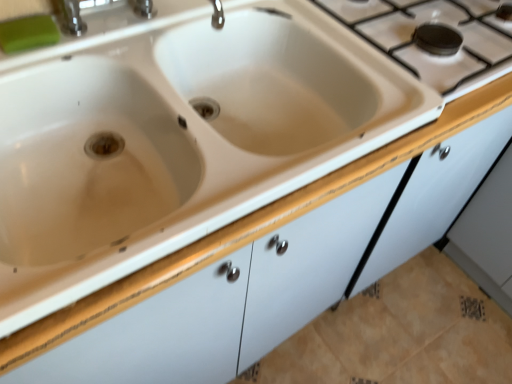
Question: Are white ceramic sink at center and white ceramic gas stove at upper right located far from each other?

Choices:
 (A) no
 (B) yes

Answer: (A)

Question: Is white ceramic sink at center wider than white ceramic gas stove at upper right?

Choices:
 (A) yes
 (B) no

Answer: (A)

Question: Can you confirm if white ceramic sink at center is taller than white ceramic gas stove at upper right?

Choices:
 (A) yes
 (B) no

Answer: (A)

Question: From a real-world perspective, is white ceramic sink at center under white ceramic gas stove at upper right?

Choices:
 (A) no
 (B) yes

Answer: (B)

Question: Is white ceramic sink at center further to camera compared to white ceramic gas stove at upper right?

Choices:
 (A) yes
 (B) no

Answer: (B)

Question: Considering the positions of white ceramic gas stove at upper right and white ceramic sink at center in the image, is white ceramic gas stove at upper right bigger or smaller than white ceramic sink at center?

Choices:
 (A) big
 (B) small

Answer: (B)

Question: Relative to white ceramic sink at center, is white ceramic gas stove at upper right in front or behind?

Choices:
 (A) front
 (B) behind

Answer: (B)

Question: From their relative heights in the image, would you say white ceramic gas stove at upper right is taller or shorter than white ceramic sink at center?

Choices:
 (A) short
 (B) tall

Answer: (A)

Question: From a real-world perspective, is white ceramic gas stove at upper right physically located above or below white ceramic sink at center?

Choices:
 (A) below
 (B) above

Answer: (B)

Question: Would you say white ceramic gas stove at upper right is inside or outside green rubber soap at upper left?

Choices:
 (A) inside
 (B) outside

Answer: (B)

Question: From the image's perspective, is white ceramic gas stove at upper right positioned above or below green rubber soap at upper left?

Choices:
 (A) below
 (B) above

Answer: (B)

Question: In the image, is white ceramic gas stove at upper right on the left side or the right side of green rubber soap at upper left?

Choices:
 (A) right
 (B) left

Answer: (A)

Question: Is white ceramic gas stove at upper right bigger or smaller than green rubber soap at upper left?

Choices:
 (A) big
 (B) small

Answer: (A)

Question: Visually, is white ceramic sink at center positioned to the left or to the right of white ceramic gas stove at upper right?

Choices:
 (A) right
 (B) left

Answer: (B)

Question: Is white ceramic sink at center wider or thinner than white ceramic gas stove at upper right?

Choices:
 (A) wide
 (B) thin

Answer: (A)